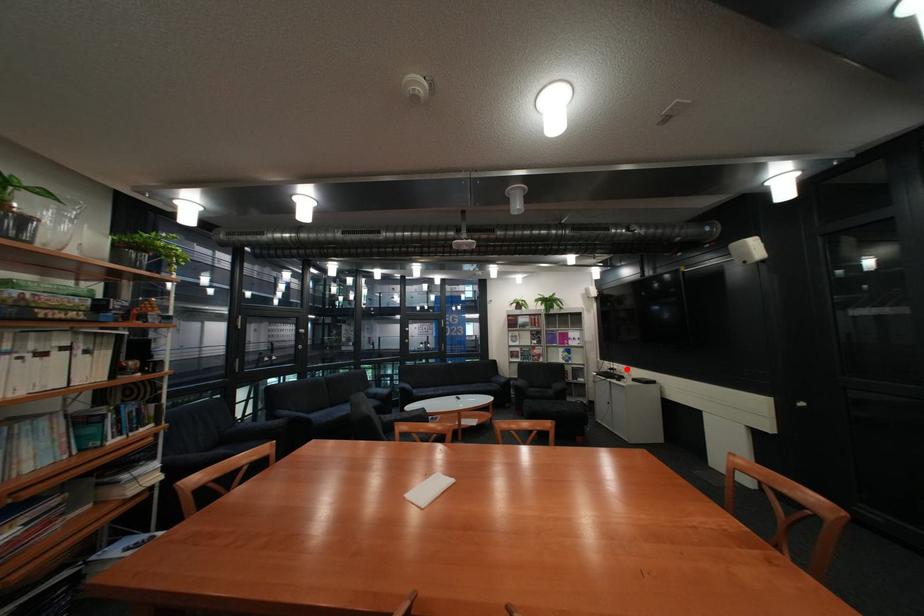
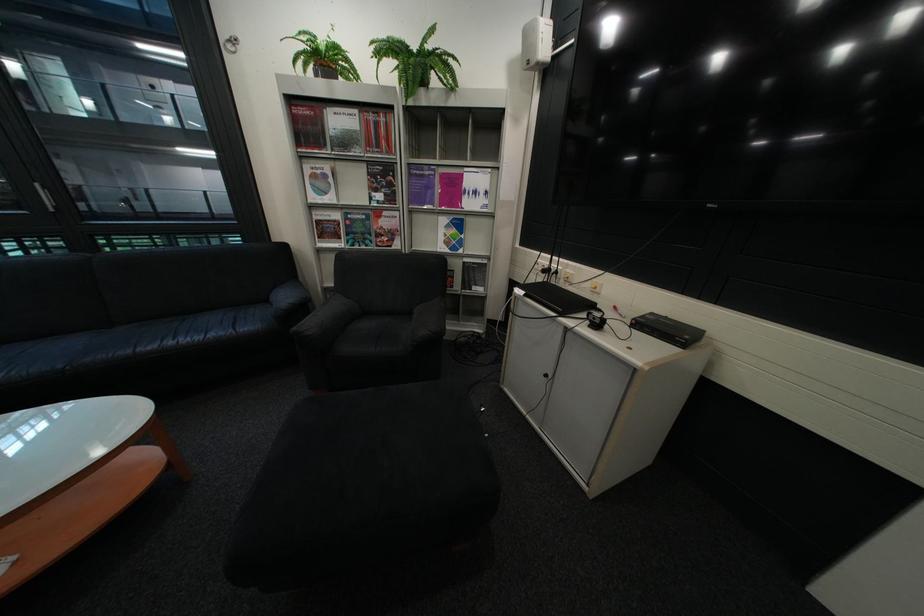
Where in the second image is the point corresponding to the highlighted location from the first image?

(563, 270)